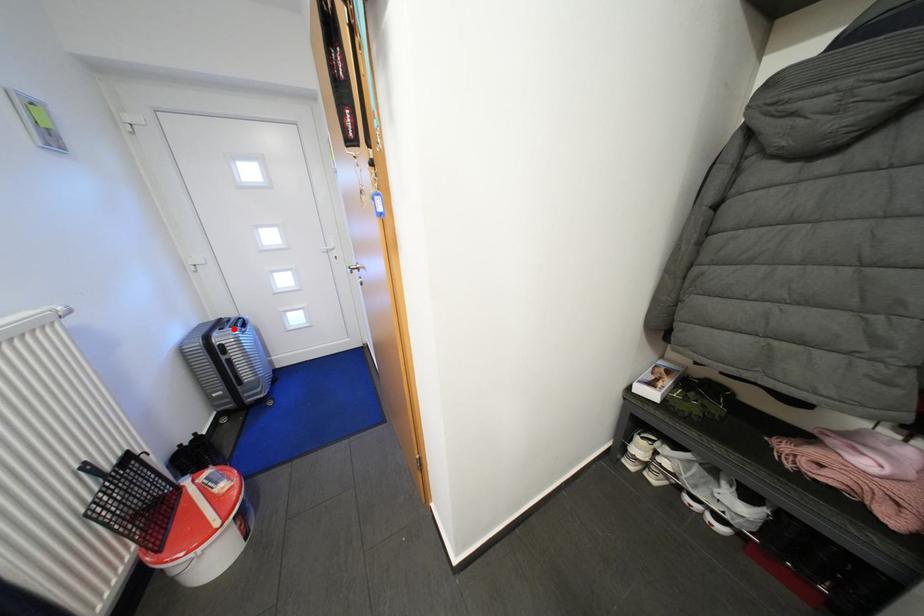
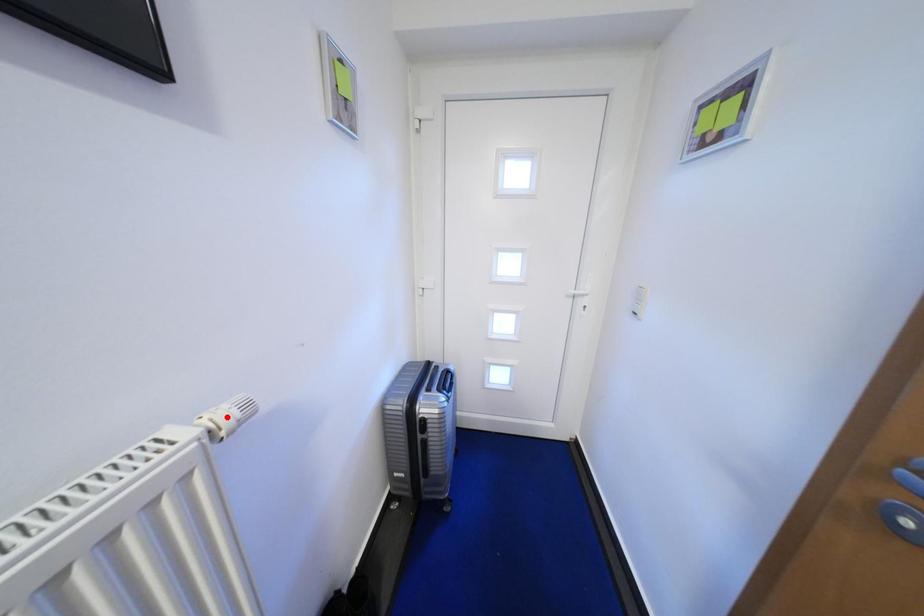
I am providing you with two images of the same scene from different viewpoints. A red point is marked on the first image and another point is marked on the second image. Is the marked point in image1 the same physical position as the marked point in image2?

No